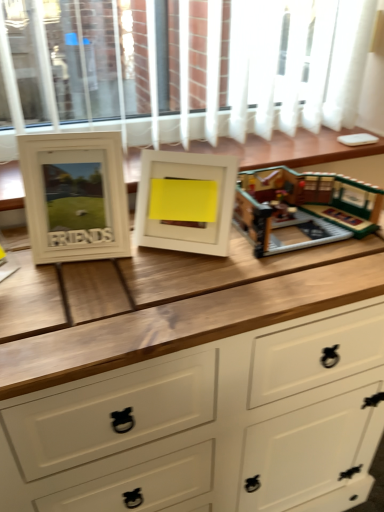
In order to click on blank space situated above white wood chest of drawers at center (from a real-world perspective) in this screenshot , I will do `click(169, 271)`.